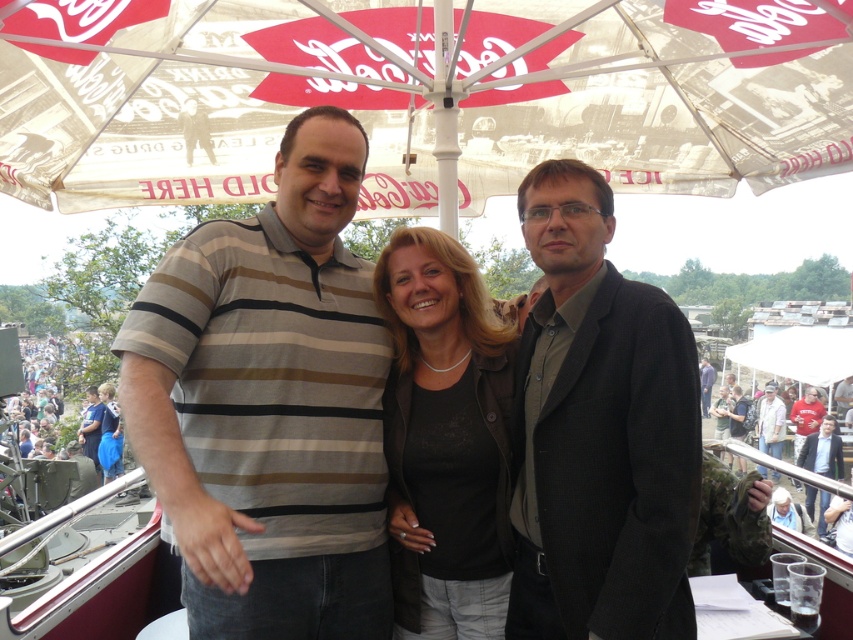
Question: Is striped cotton polo shirt at center to the left of dark blue shirt at center from the viewer's perspective?

Choices:
 (A) no
 (B) yes

Answer: (A)

Question: Which point is closer to the camera?

Choices:
 (A) (9, 128)
 (B) (277, 609)
 (C) (614, 522)

Answer: (C)

Question: Does white fabric umbrella at upper center have a smaller size compared to striped cotton polo shirt at center?

Choices:
 (A) yes
 (B) no

Answer: (B)

Question: Which of the following is the closest to the observer?

Choices:
 (A) (96, 387)
 (B) (173, 65)
 (C) (763, 477)

Answer: (C)

Question: Which point is closer to the camera?

Choices:
 (A) (386, 346)
 (B) (764, 477)
 (C) (706, 381)

Answer: (A)

Question: Considering the relative positions of dark gray woolen jacket at center and light brown leather jacket at center in the image provided, where is dark gray woolen jacket at center located with respect to light brown leather jacket at center?

Choices:
 (A) above
 (B) below

Answer: (A)